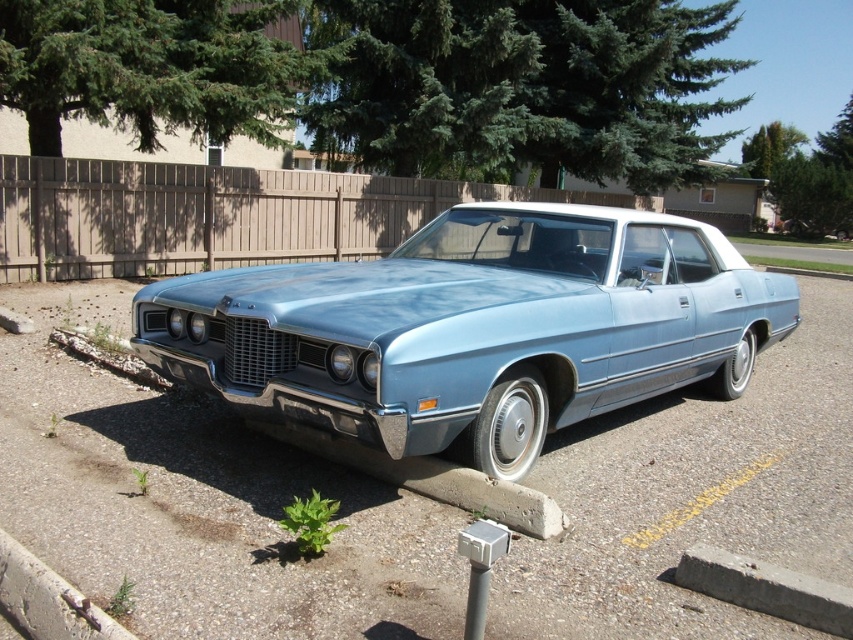
You are standing at the origin point in the image. Which direction should you move to reach the metallic blue car at center?

You should move towards the right and slightly downward from the origin point to reach the metallic blue car at center located at coordinates point (201, 502).

You are standing in front of the vintage car and want to place a small decoration on one of the two points mentioned. Which point is closer to you, point [442,353] or point [28,563]?

Point [442,353] is closer to you than point [28,563].

You are a delivery person trying to park your van in the driveway. You see the metallic blue car at center and the concrete at lower left. Which area is higher in elevation compared to the other?

The metallic blue car at center is above concrete at lower left, so the metallic blue car at center is higher in elevation than the concrete at lower left.